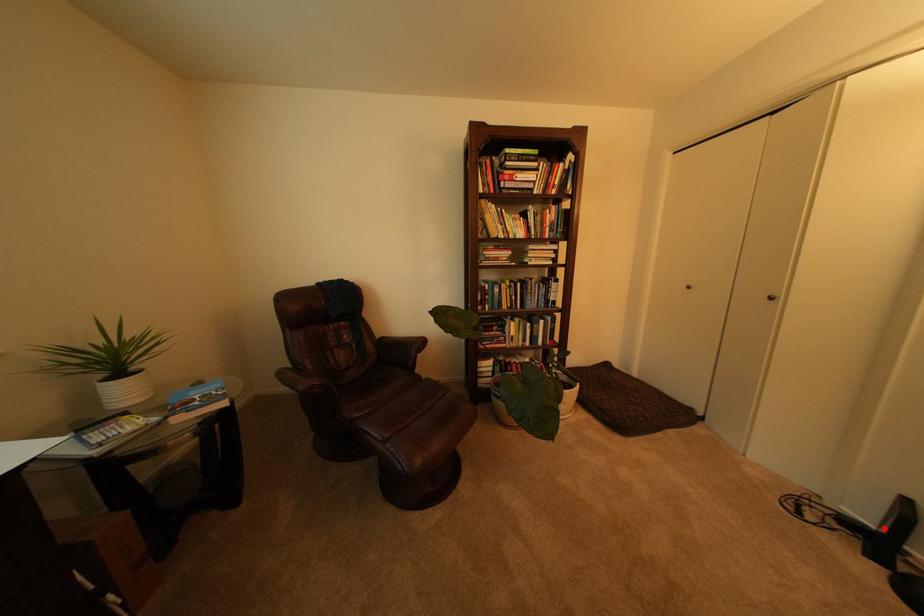
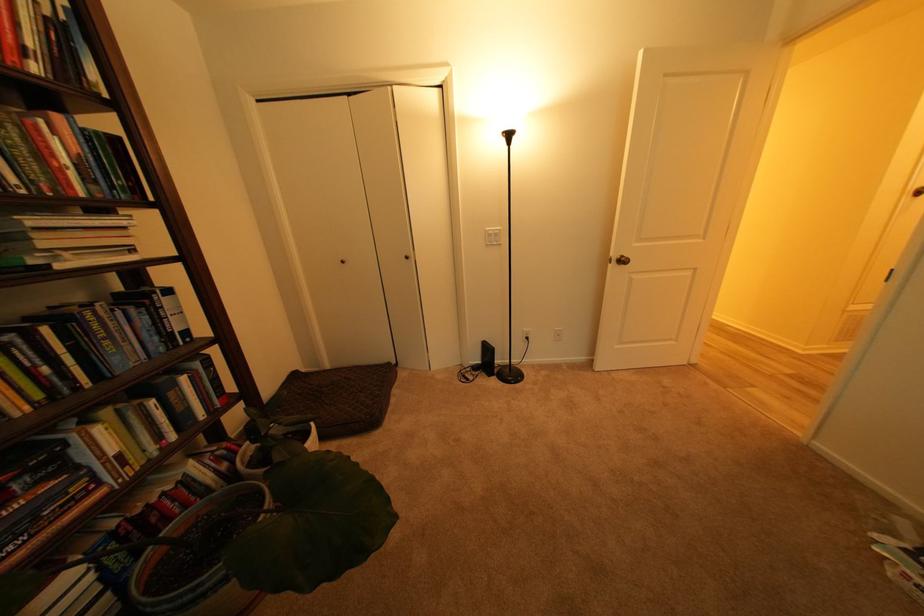
Where in the second image is the point corresponding to the highlighted location from the first image?

(490, 363)